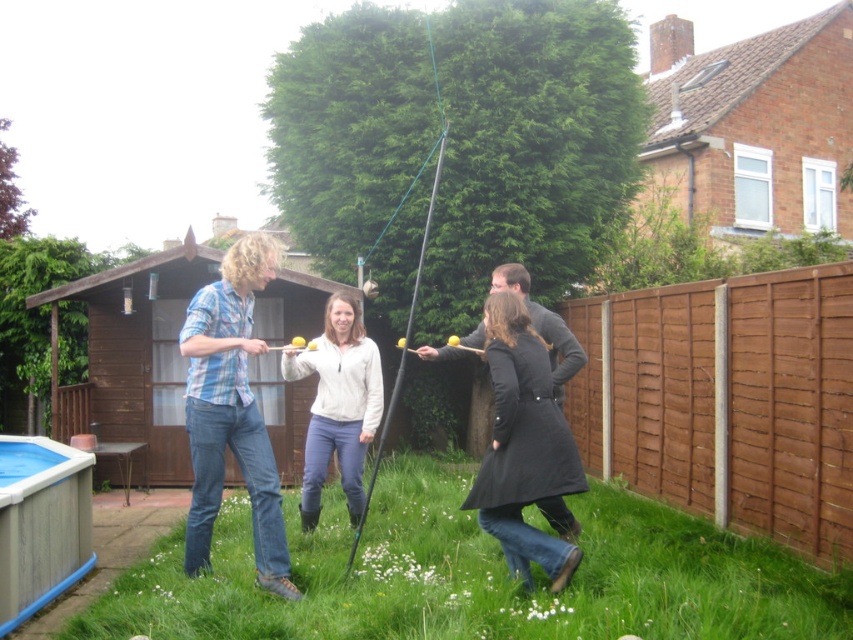
Who is more forward, (x=828, y=621) or (x=569, y=346)?

Positioned in front is point (x=828, y=621).

Where is `green grass at lower center`? This screenshot has height=640, width=853. green grass at lower center is located at coordinates click(477, 577).

I want to click on green grass at lower center, so click(x=477, y=577).

Image resolution: width=853 pixels, height=640 pixels. I want to click on green grass at lower center, so click(477, 577).

Does brown wooden fence at right appear on the left side of black leather coat at center?

In fact, brown wooden fence at right is to the right of black leather coat at center.

Is brown wooden fence at right closer to camera compared to black leather coat at center?

No.

Find the location of a particular element. brown wooden fence at right is located at coordinates (726, 401).

Is green grass at lower center shorter than blue plaid shirt at center?

Correct, green grass at lower center is not as tall as blue plaid shirt at center.

Is point (457, 522) closer to camera compared to point (209, 332)?

No.

Who is more distant from viewer, (236, 588) or (265, 474)?

Positioned behind is point (265, 474).

At what (x,y) coordinates should I click in order to perform the action: click on green grass at lower center. Please return your answer as a coordinate pair (x, y). The image size is (853, 640). Looking at the image, I should click on (477, 577).